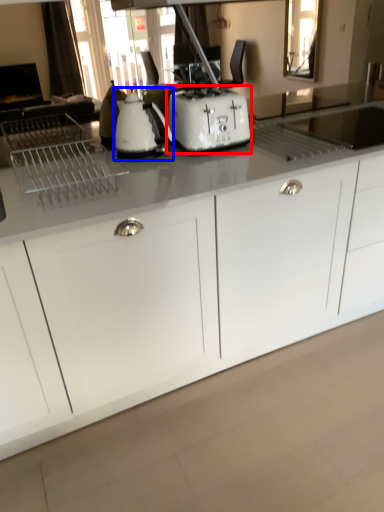
Question: Which object appears farthest to the camera in this image, toaster (highlighted by a red box) or kitchen appliance (highlighted by a blue box)?

Choices:
 (A) toaster
 (B) kitchen appliance

Answer: (A)